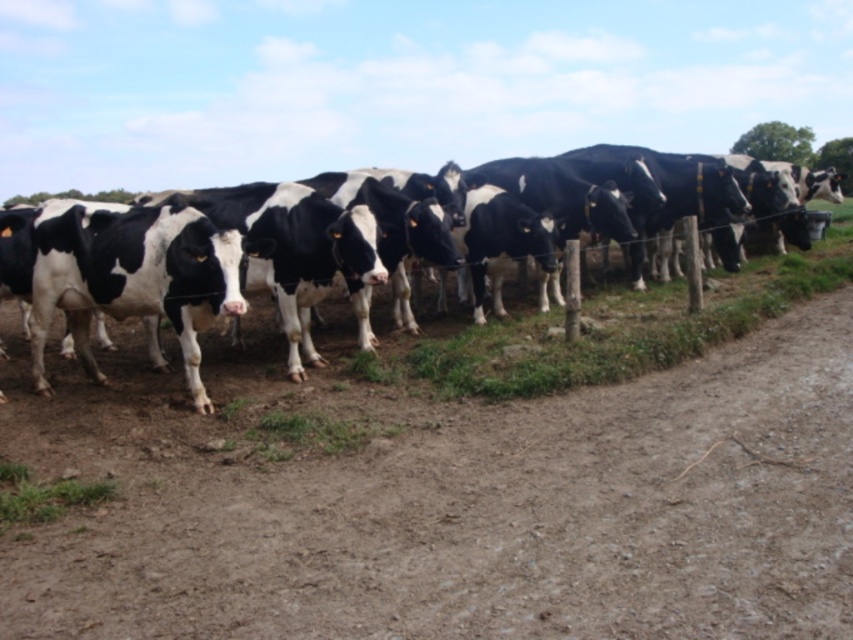
Is brown sandy dirt at lower center positioned before black and white cow at center?

Yes.

In the scene shown: Is brown sandy dirt at lower center thinner than black and white cow at center?

No, brown sandy dirt at lower center is not thinner than black and white cow at center.

Which is in front, point (502, 577) or point (531, 321)?

Point (502, 577) is more forward.

Identify the location of brown sandy dirt at lower center. (468, 512).